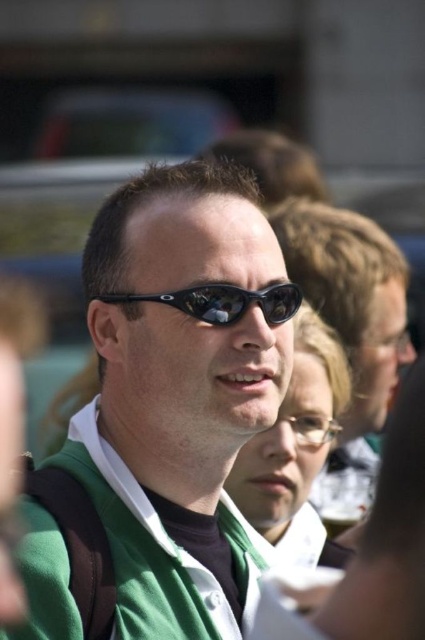
You are a fashion designer analyzing this image. You need to determine the spatial relationship between the green matte jacket at center and the black plastic sunglasses at center. Which object is positioned higher in the image?

The black plastic sunglasses at center are positioned higher than the green matte jacket at center because the green matte jacket at center is located below the black plastic sunglasses at center.

You are a photographer trying to capture a portrait of the man wearing the green vest. You notice the black plastic sunglasses at center and the clear glass beer at center in the frame. Since you want to focus on the man, which object should you adjust your camera to avoid, considering their sizes?

The black plastic sunglasses at center has a larger size compared to the clear glass beer at center, so you should adjust your camera to avoid the black plastic sunglasses at center as it is bigger and more likely to distract from the man.

You are a photographer adjusting your camera settings. You need to focus on both the green matte jacket at center and the clear glass beer at center. Which object should you adjust your focus to first if you want to ensure the larger object is in sharp focus?

The green matte jacket at center has a larger size compared to the clear glass beer at center, so you should focus on the green matte jacket at center first to ensure it is in sharp focus.